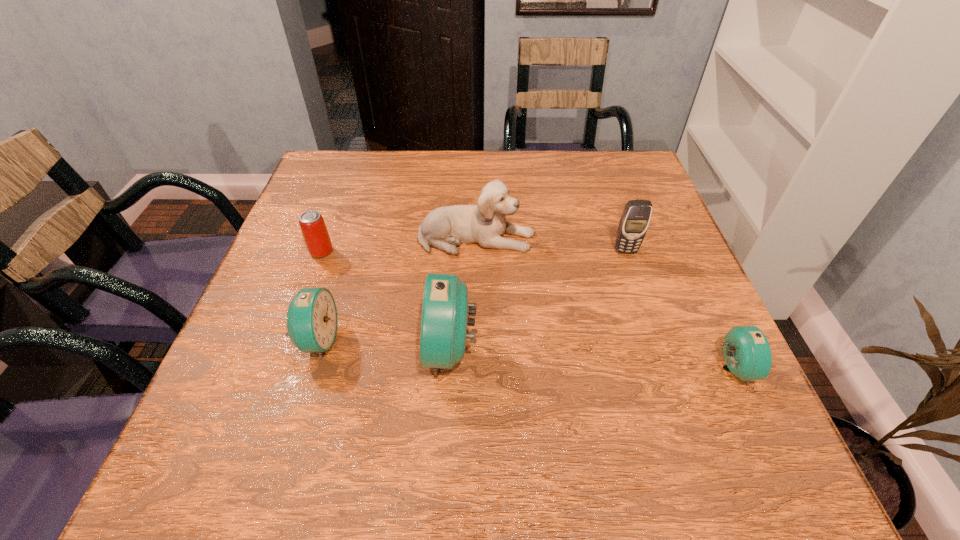
Identify the location of the leftmost alarm clock. The image size is (960, 540). (312, 314).

What are the coordinates of `the tallest object` in the screenshot? It's located at (443, 318).

Find the location of a particular element. This screenshot has width=960, height=540. the second alarm clock from right to left is located at coordinates (443, 318).

Identify the location of the rightmost alarm clock. The height and width of the screenshot is (540, 960). (747, 354).

This screenshot has height=540, width=960. I want to click on the rightmost object, so click(747, 354).

Identify the location of cellular telephone. Image resolution: width=960 pixels, height=540 pixels. (635, 219).

Locate an element on the screen. The height and width of the screenshot is (540, 960). puppy is located at coordinates (484, 224).

Locate an element on the screen. beer can is located at coordinates (315, 233).

Where is `free space located on the front-facing side of the leftmost alarm clock`? The width and height of the screenshot is (960, 540). free space located on the front-facing side of the leftmost alarm clock is located at coordinates (417, 340).

The width and height of the screenshot is (960, 540). I want to click on blank space located on the front-facing side of the tallest object, so click(x=371, y=349).